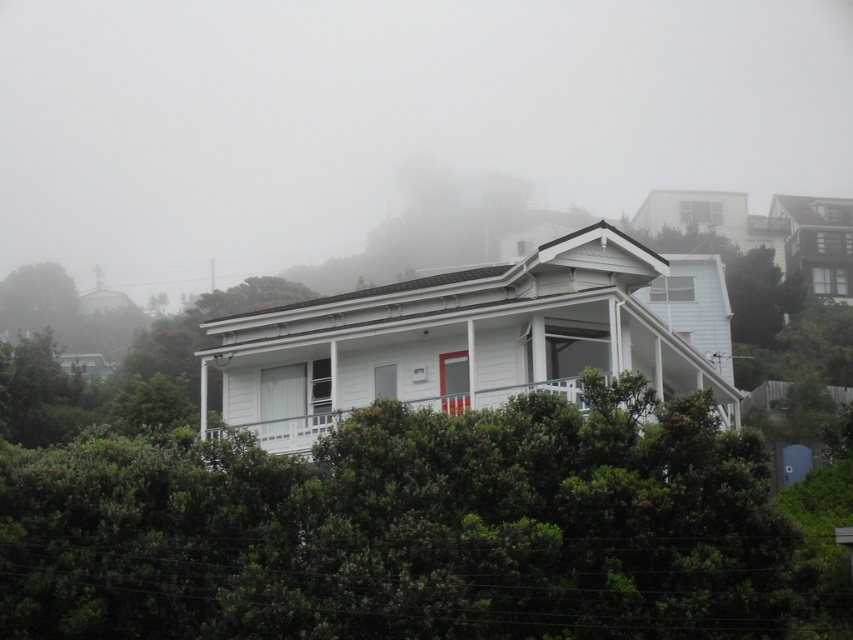
Is foggy white house at center above white painted wood porch at center?

Indeed, foggy white house at center is positioned over white painted wood porch at center.

Who is positioned more to the left, foggy white house at center or white painted wood porch at center?

foggy white house at center is more to the left.

Which is in front, point (849, 52) or point (624, 380)?

Point (624, 380) is more forward.

The image size is (853, 640). I want to click on foggy white house at center, so click(x=387, y=118).